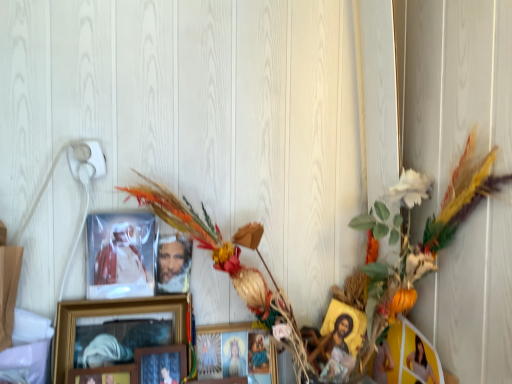
Question: Is point (141, 311) positioned closer to the camera than point (202, 354)?

Choices:
 (A) closer
 (B) farther

Answer: (A)

Question: Is wooden framed picture at center, the second picture frame viewed from the left, spatially inside matte wooden picture frame at center, the fourth picture frame in the left-to-right sequence, or outside of it?

Choices:
 (A) outside
 (B) inside

Answer: (A)

Question: Considering the real-world distances, which object is closest to the matte plastic figure at upper left?

Choices:
 (A) matte wooden picture frame at center, acting as the third picture frame starting from the right
 (B) matte wooden picture frame at center, the fourth picture frame in the left-to-right sequence
 (C) matte yellow photo frame at right, the first picture frame viewed from the right
 (D) wooden framed picture at center, the second picture frame viewed from the left
 (E) wooden picture frame at lower left, acting as the 5th picture frame starting from the right

Answer: (D)

Question: Which object is the closest to the matte wooden picture frame at center, which is the 3th picture frame from left to right?

Choices:
 (A) matte wooden picture frame at center, the fourth picture frame in the left-to-right sequence
 (B) wooden framed picture at center, which is counted as the fourth picture frame, starting from the right
 (C) matte plastic figure at upper left
 (D) wooden picture frame at lower left, positioned as the first picture frame in left-to-right order
 (E) matte yellow photo frame at right, marked as the fifth picture frame in a left-to-right arrangement

Answer: (D)